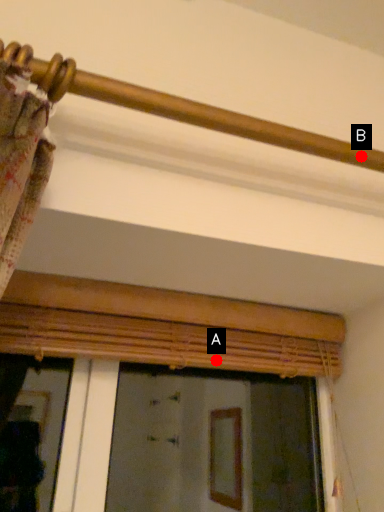
Question: Two points are circled on the image, labeled by A and B beside each circle. Which of the following is the farthest from the observer?

Choices:
 (A) A is further
 (B) B is further

Answer: (A)